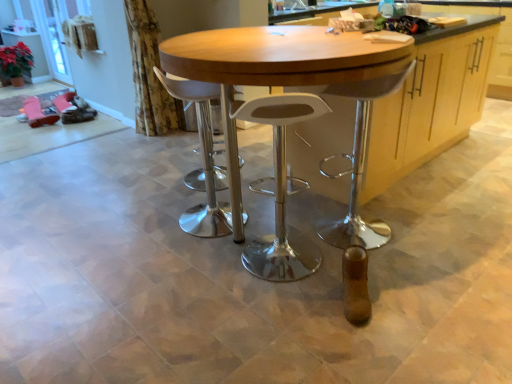
Identify the location of free space in front of wooden table at center. This screenshot has width=512, height=384. (285, 322).